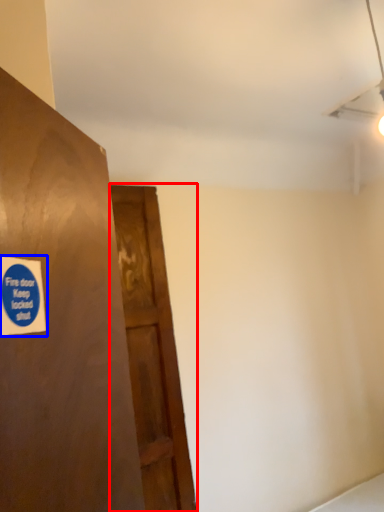
Question: Which point is further to the camera, door (highlighted by a red box) or sticker (highlighted by a blue box)?

Choices:
 (A) door
 (B) sticker

Answer: (A)